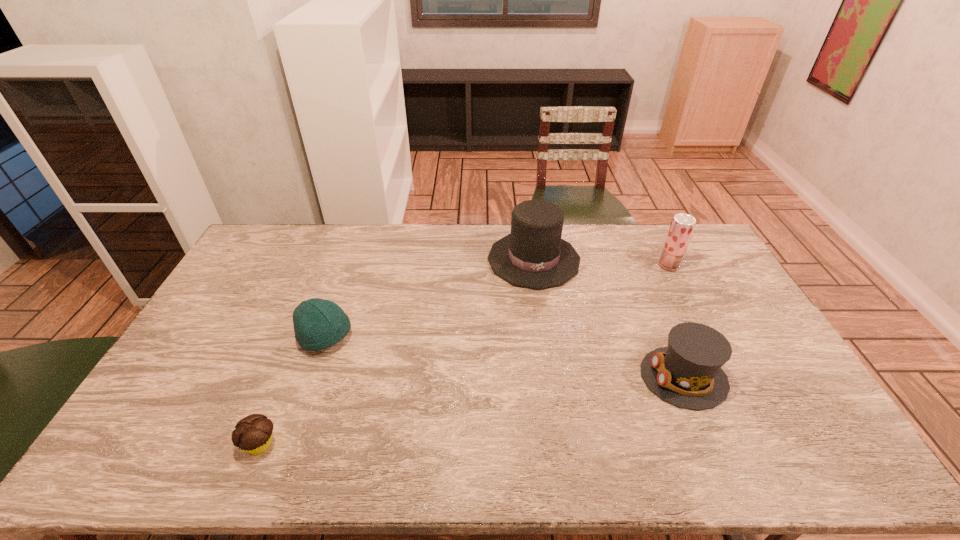
Find the location of a particular element. The width and height of the screenshot is (960, 540). vacant space at the far edge of the desktop is located at coordinates (330, 234).

The height and width of the screenshot is (540, 960). What are the coordinates of `free location at the near edge` in the screenshot? It's located at (334, 463).

Image resolution: width=960 pixels, height=540 pixels. Identify the location of vacant area at the left edge. (215, 355).

In the image, there is a desktop. Where is `vacant space at the right edge`? The width and height of the screenshot is (960, 540). vacant space at the right edge is located at coordinates (817, 437).

Where is `free region at the near right corner of the desktop`? The image size is (960, 540). free region at the near right corner of the desktop is located at coordinates (808, 465).

Image resolution: width=960 pixels, height=540 pixels. I want to click on vacant space that's between the fruit juice and the shorter dress hat, so click(x=676, y=321).

Where is `free space between the shorter dress hat and the fruit juice`? free space between the shorter dress hat and the fruit juice is located at coordinates (676, 321).

Image resolution: width=960 pixels, height=540 pixels. I want to click on blank region between the nearest object and the fruit juice, so click(465, 355).

Identify the location of free point between the beanie and the muffin. Image resolution: width=960 pixels, height=540 pixels. (293, 390).

The image size is (960, 540). Identify the location of free space between the fruit juice and the nearer dress hat. (676, 321).